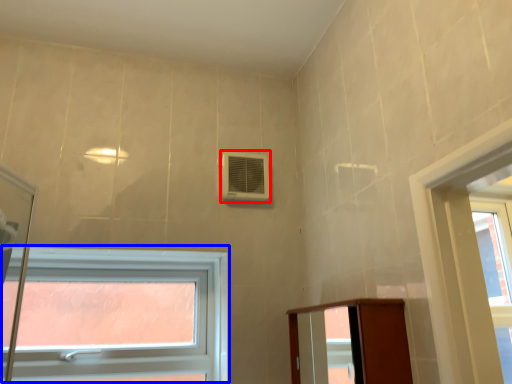
Question: Which point is closer to the camera, air conditioning (highlighted by a red box) or window (highlighted by a blue box)?

Choices:
 (A) air conditioning
 (B) window

Answer: (B)